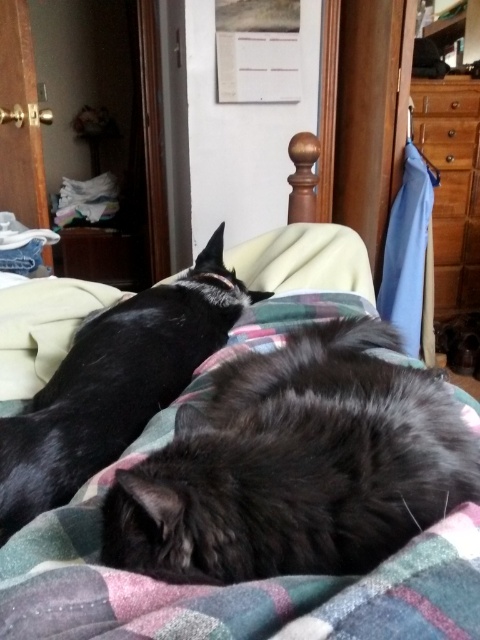
You are a cat owner who wants to separate the two cats for feeding. Since the door to the left is slightly open, can you guide the fluffy black cat at center through the door to the other side without moving the shiny black cat at left?

The fluffy black cat at center is to the right of the shiny black cat at left. Since the door is on the left side of the image, the fluffy black cat at center would need to move around the shiny black cat at left to reach the door. However, since the cats are lying close together, moving one might disturb the other, making it difficult to guide the fluffy black cat at center through the door without moving the shiny black cat at left.

You are standing at the entrance of the room and want to approach the fluffy black cat at center. Based on its coordinates, where should you move to find it?

The fluffy black cat at center is located at coordinates point (296, 465), so you should move towards the center area of the bed to find it.